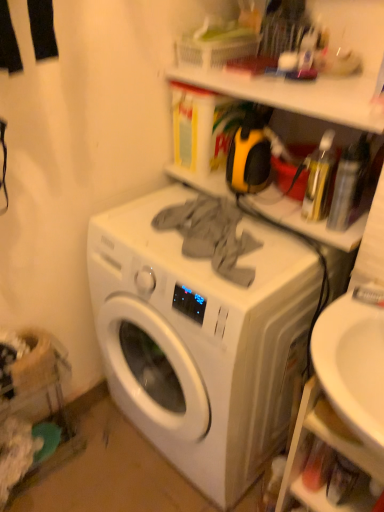
The width and height of the screenshot is (384, 512). What are the coordinates of `empty space that is ontop of white plastic shelf at upper center, the third shelf from the bottom` in the screenshot? It's located at (311, 87).